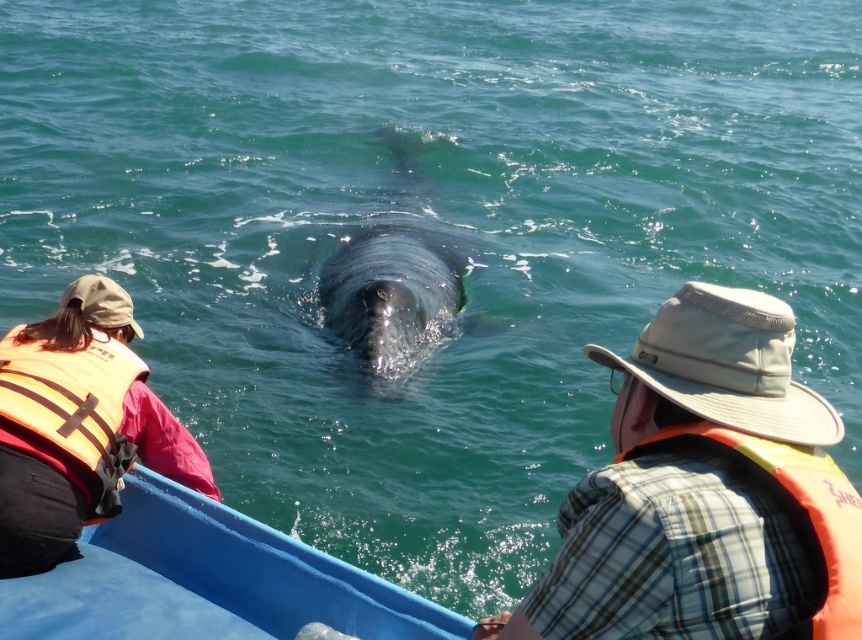
You are planning to take a group of 5 people on a whale watching tour. The blue plastic boat at center can hold up to 4 people. Considering the space occupied by the gray matte whale at center, will there be enough room for everyone?

The blue plastic boat at center occupies less space than the gray matte whale at center, so it may not have enough room for 5 people since it can only hold 4. The whale takes up more space, but the boat is already at capacity with 4 passengers.